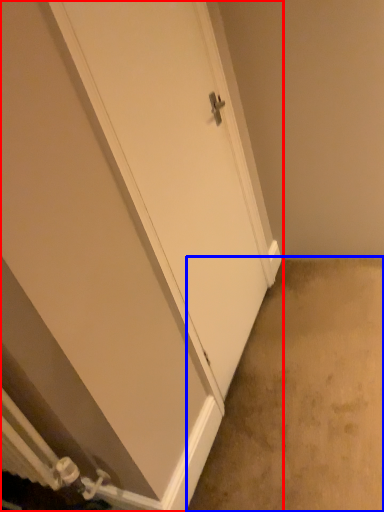
Question: Which of the following is the closest to the observer, door (highlighted by a red box) or concrete (highlighted by a blue box)?

Choices:
 (A) door
 (B) concrete

Answer: (A)